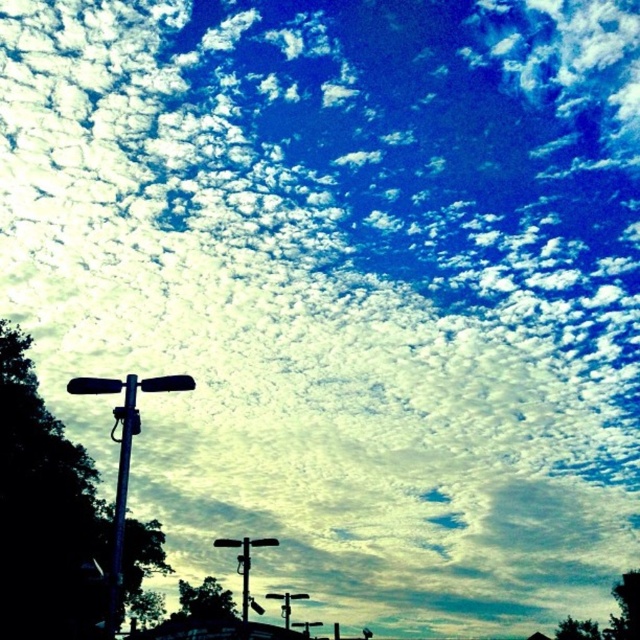
You are standing at the center of the image and want to walk towards the metallic blue pole at left. In which direction should you move?

Since the metallic blue pole at left is located at point (120, 500), you should move towards the left direction to reach it.

You are standing in the scene and see the point marked at coordinates (120, 500). What object is located at that point?

The point at (120, 500) indicates a metallic blue pole at left.

You are a city planner analyzing the image of the city skyline. You notice two metallic poles, the metallic pole at left and the metallic pole at center. Which pole has a smaller diameter?

The metallic pole at left has a smaller diameter than the metallic pole at center.